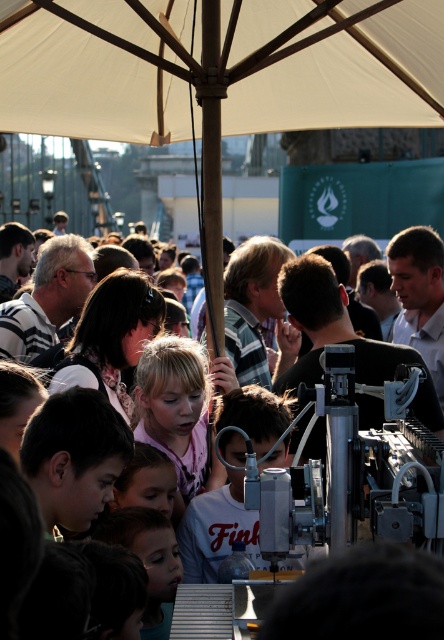
You are a photographer trying to capture a clear shot of the blonde hair at center without the white fabric canopy at upper center blocking the view. Is it possible to do so given their sizes?

The white fabric canopy at upper center has a larger size compared to blonde hair at center, so it might block the view. However, since the canopy is at the upper center and the hair is at the center, adjusting the camera angle slightly downward could allow capturing the blonde hair at center without obstruction from the larger canopy.

You are attending an outdoor event under the shade provided by both the white fabric umbrella at upper center and the white fabric canopy at upper center. You want to know which structure offers more vertical space for taller individuals. Based on the scene, which one is taller?

The white fabric umbrella at upper center is taller than the white fabric canopy at upper center, so it offers more vertical space for taller individuals.